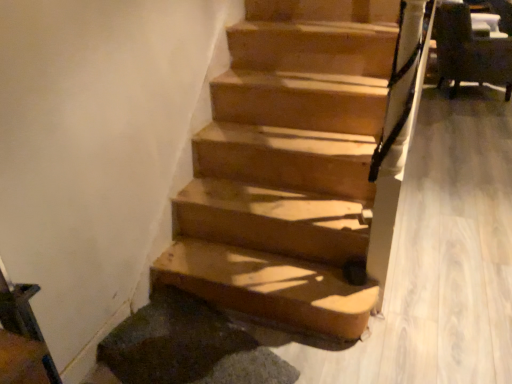
Question: Is dark brown leather armchair at upper right spatially inside wooden stairs at center, or outside of it?

Choices:
 (A) outside
 (B) inside

Answer: (A)

Question: Is point (460, 76) positioned closer to the camera than point (335, 0)?

Choices:
 (A) closer
 (B) farther

Answer: (B)

Question: Would you say dark brown leather armchair at upper right is to the left or to the right of wooden stairs at center in the picture?

Choices:
 (A) left
 (B) right

Answer: (B)

Question: From the image's perspective, relative to dark brown leather armchair at upper right, is wooden stairs at center above or below?

Choices:
 (A) below
 (B) above

Answer: (A)

Question: Considering the positions of point [331, 61] and point [483, 69], is point [331, 61] closer or farther from the camera than point [483, 69]?

Choices:
 (A) farther
 (B) closer

Answer: (B)

Question: In terms of size, does wooden stairs at center appear bigger or smaller than dark brown leather armchair at upper right?

Choices:
 (A) small
 (B) big

Answer: (B)

Question: Choose the correct answer: Is wooden stairs at center inside dark brown leather armchair at upper right or outside it?

Choices:
 (A) outside
 (B) inside

Answer: (A)